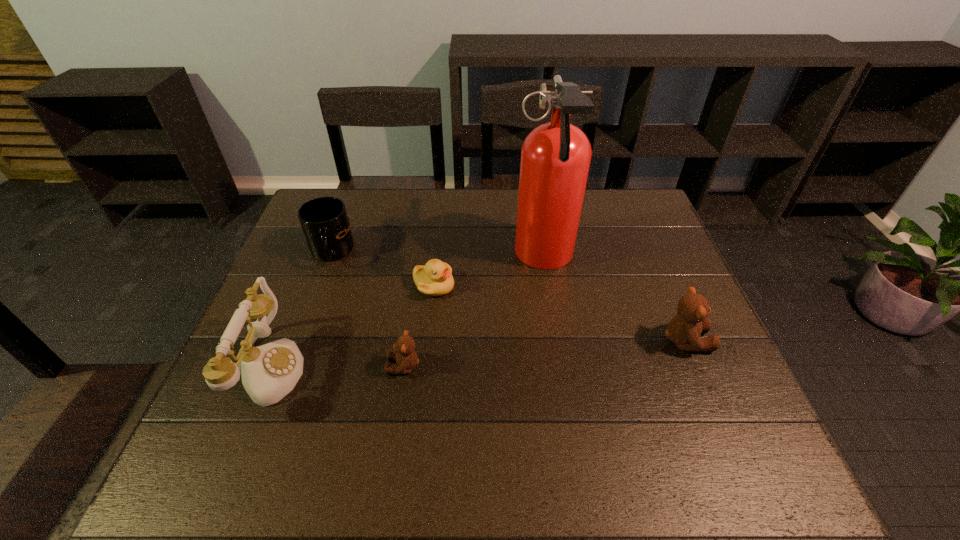
Identify the location of vacant region located 0.240m on the face of the left teddy bear. This screenshot has height=540, width=960. (282, 366).

Identify the location of free space located 0.270m with the handle on the side of the mug. Image resolution: width=960 pixels, height=540 pixels. (295, 351).

Where is `free spot located 0.330m on the front of the fifth object from left to right`? free spot located 0.330m on the front of the fifth object from left to right is located at coordinates (566, 403).

This screenshot has height=540, width=960. I want to click on blank space located on the beak of the duckling, so click(x=543, y=286).

Find the location of a particular element. This screenshot has height=540, width=960. free space located on the dial of the second tallest object is located at coordinates (345, 368).

Find the location of a particular element. The image size is (960, 540). object present at the far edge is located at coordinates (555, 157).

The height and width of the screenshot is (540, 960). Identify the location of object present at the near edge. (269, 372).

The height and width of the screenshot is (540, 960). In order to click on mug situated at the left edge in this screenshot , I will do `click(324, 220)`.

The height and width of the screenshot is (540, 960). In order to click on telephone positioned at the left edge in this screenshot , I will do `click(269, 372)`.

Where is `object located in the right edge section of the desktop`? object located in the right edge section of the desktop is located at coordinates (684, 330).